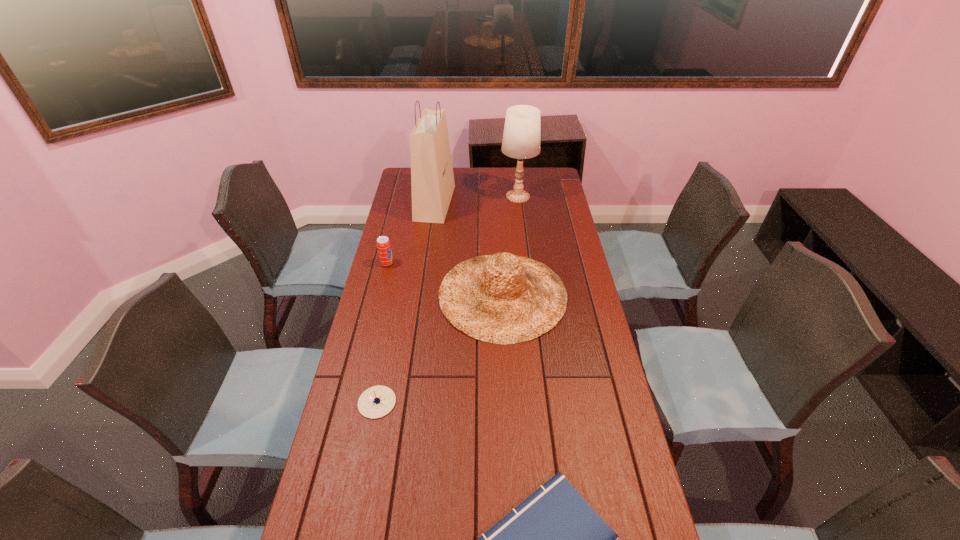
Locate an element on the screen. This screenshot has height=540, width=960. shopping bag is located at coordinates (432, 180).

Locate an element on the screen. The height and width of the screenshot is (540, 960). lamp is located at coordinates (522, 136).

The height and width of the screenshot is (540, 960). What are the coordinates of `the third tallest object` in the screenshot? It's located at (504, 299).

Image resolution: width=960 pixels, height=540 pixels. What are the coordinates of `soda can` in the screenshot? It's located at (383, 244).

Where is `the fifth tallest object`? This screenshot has width=960, height=540. the fifth tallest object is located at coordinates (375, 402).

Locate an element on the screen. the second nearest object is located at coordinates tap(375, 402).

The height and width of the screenshot is (540, 960). Find the location of `vacant space situated on the right of the shopping bag`. vacant space situated on the right of the shopping bag is located at coordinates (488, 202).

Where is `vacant region located 0.120m on the left of the lamp`? This screenshot has height=540, width=960. vacant region located 0.120m on the left of the lamp is located at coordinates (475, 197).

The width and height of the screenshot is (960, 540). I want to click on vacant space located 0.210m on the left of the third tallest object, so click(x=381, y=295).

At what (x,y) coordinates should I click in order to perform the action: click on vacant region located on the back of the soda can. Please return your answer as a coordinate pair (x, y). The height and width of the screenshot is (540, 960). Looking at the image, I should click on (394, 237).